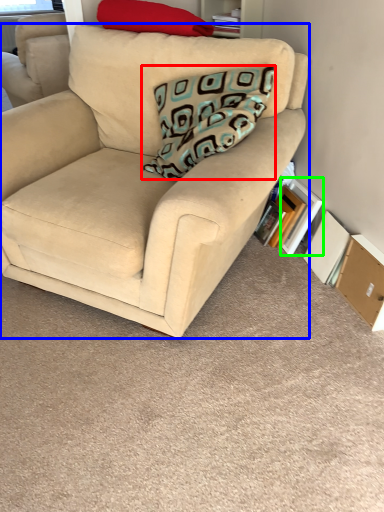
Question: Estimate the real-world distances between objects in this image. Which object is closer to pillow (highlighted by a red box), studio couch (highlighted by a blue box) or paperback book (highlighted by a green box)?

Choices:
 (A) studio couch
 (B) paperback book

Answer: (A)